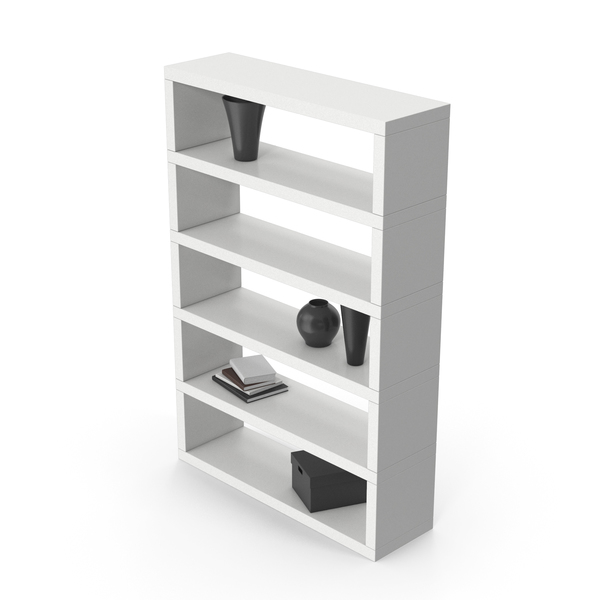
Find the location of `tall black vase`. tall black vase is located at coordinates (350, 340).